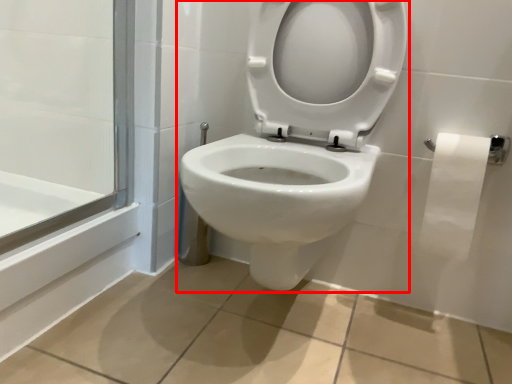
Question: Observing the image, what is the correct spatial positioning of toilet (annotated by the red box) in reference to toilet paper?

Choices:
 (A) right
 (B) left

Answer: (B)